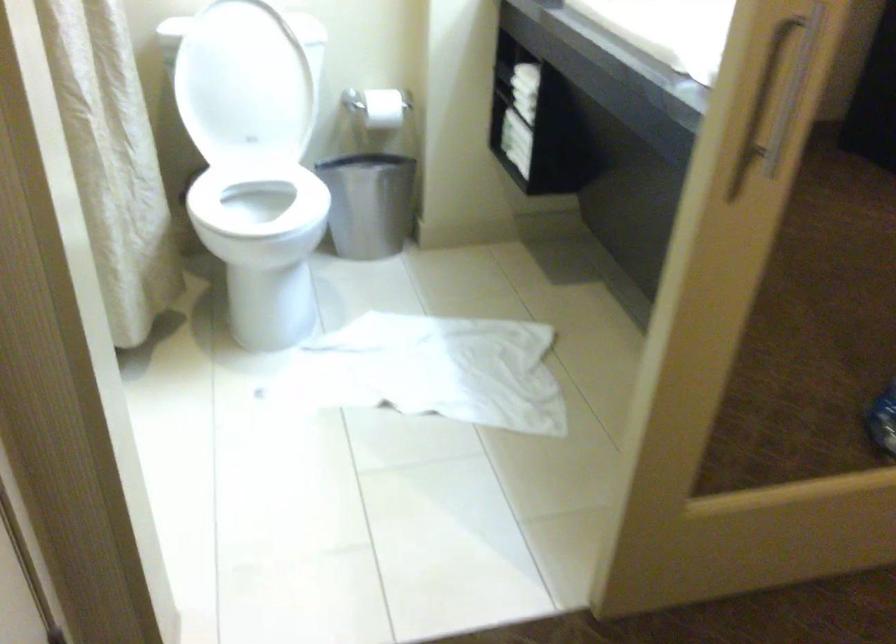
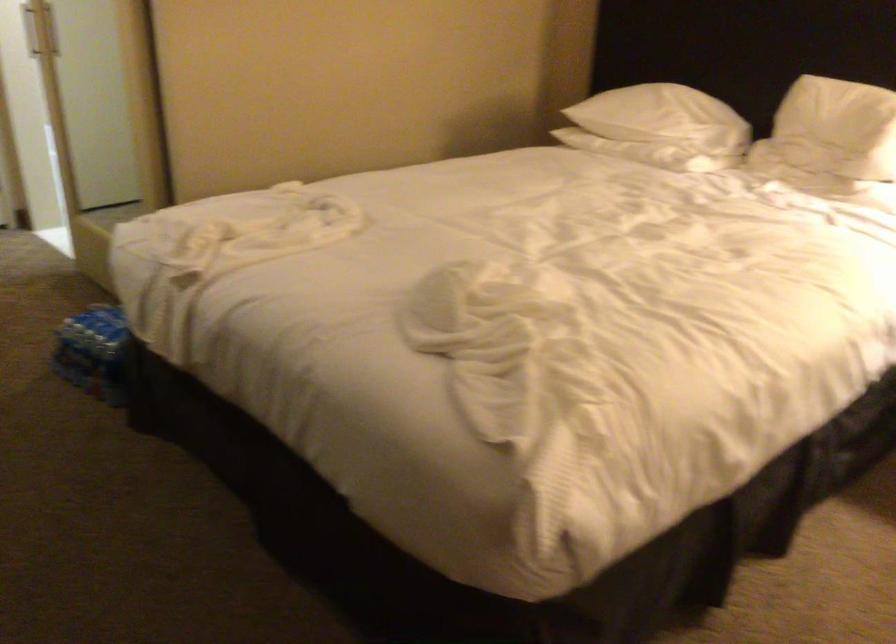
The point at [787,122] is marked in the first image. Where is the corresponding point in the second image?

(39, 29)